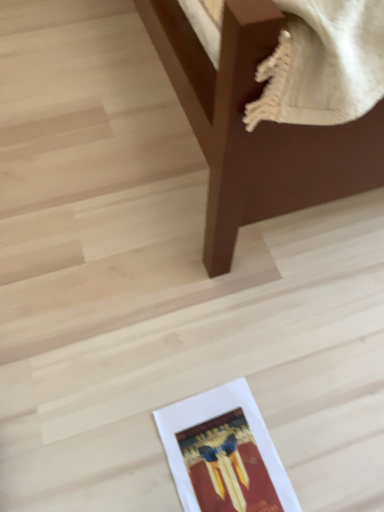
I want to click on free spot below matte paper paperback book at lower center (from a real-world perspective), so click(x=223, y=458).